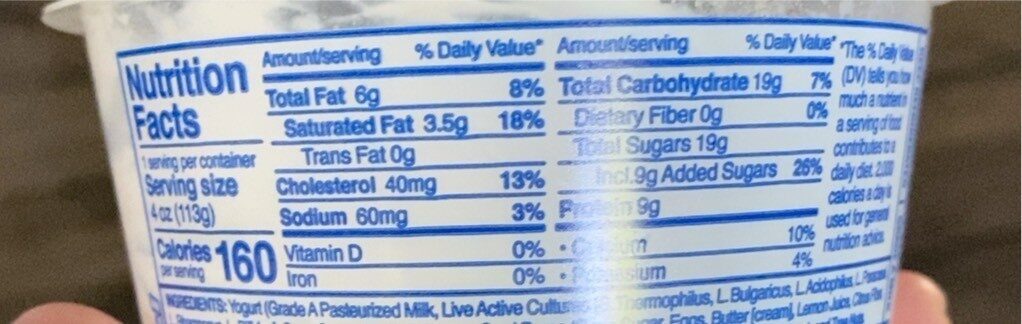
Where is `empty space left of tub`? empty space left of tub is located at coordinates (68, 170).